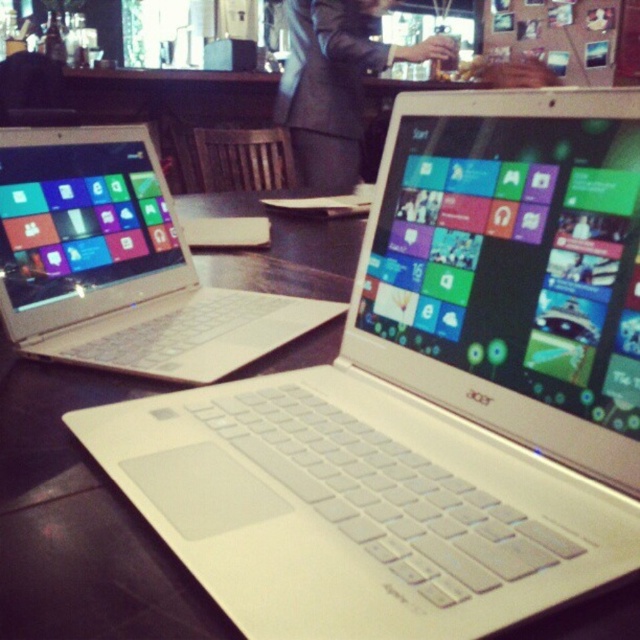
Can you confirm if white plastic laptop at left is thinner than dark suit at center?

Correct, white plastic laptop at left's width is less than dark suit at center's.

Does white plastic laptop at left have a greater height compared to dark suit at center?

In fact, white plastic laptop at left may be shorter than dark suit at center.

Is point (163, 225) farther from camera compared to point (384, 51)?

No, (163, 225) is in front of (384, 51).

Where is `white plastic laptop at left`? white plastic laptop at left is located at coordinates (120, 264).